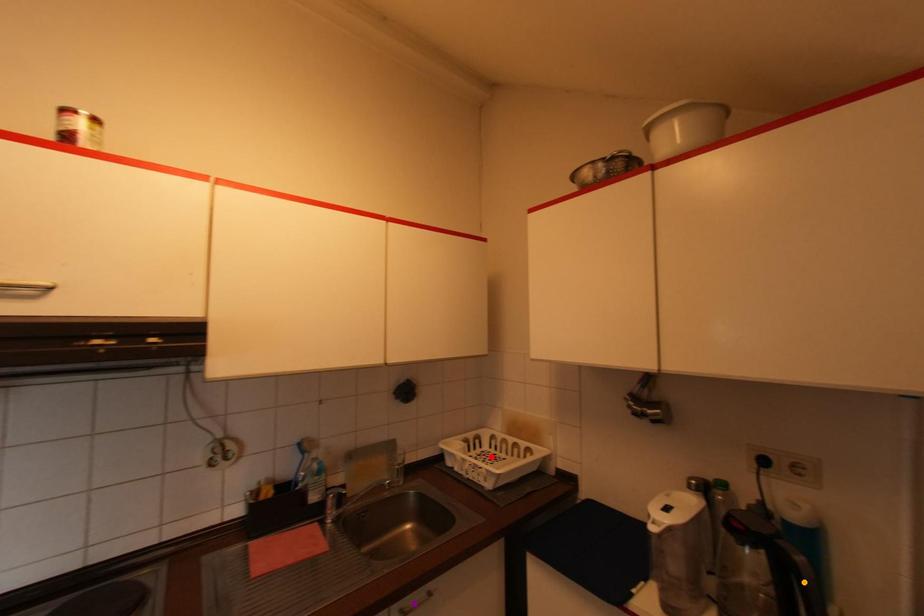
Order these from nearest to farthest:
red point
orange point
purple point

1. red point
2. purple point
3. orange point